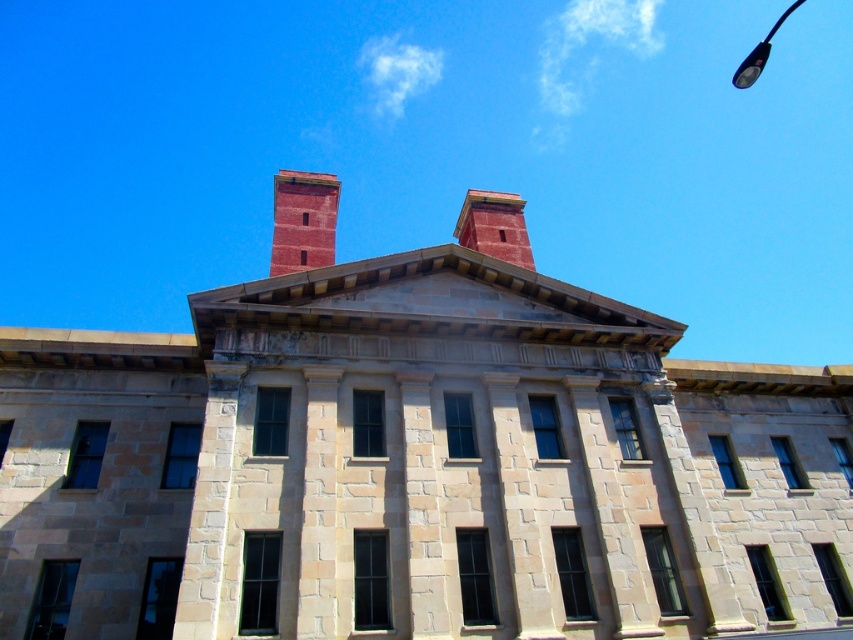
Between point (286, 212) and point (746, 72), which one is positioned behind?

Positioned behind is point (746, 72).

Locate an element on the screen. smooth brick chimney at upper center is located at coordinates (303, 220).

This screenshot has width=853, height=640. In order to click on smooth brick chimney at upper center in this screenshot , I will do `click(303, 220)`.

Who is lower down, brick chimney at center or metallic pole at upper right?

brick chimney at center

Who is more distant from viewer, (485, 253) or (740, 83)?

Point (740, 83)

The image size is (853, 640). What are the coordinates of `brick chimney at center` in the screenshot? It's located at (494, 227).

Who is more forward, (x=297, y=241) or (x=503, y=241)?

Point (x=297, y=241) is in front.

Can you confirm if smooth brick chimney at upper center is shorter than brick chimney at center?

No, smooth brick chimney at upper center is not shorter than brick chimney at center.

Which is behind, point (286, 257) or point (511, 198)?

The point (511, 198) is behind.

At what (x,y) coordinates should I click in order to perform the action: click on smooth brick chimney at upper center. Please return your answer as a coordinate pair (x, y). The height and width of the screenshot is (640, 853). Looking at the image, I should click on (303, 220).